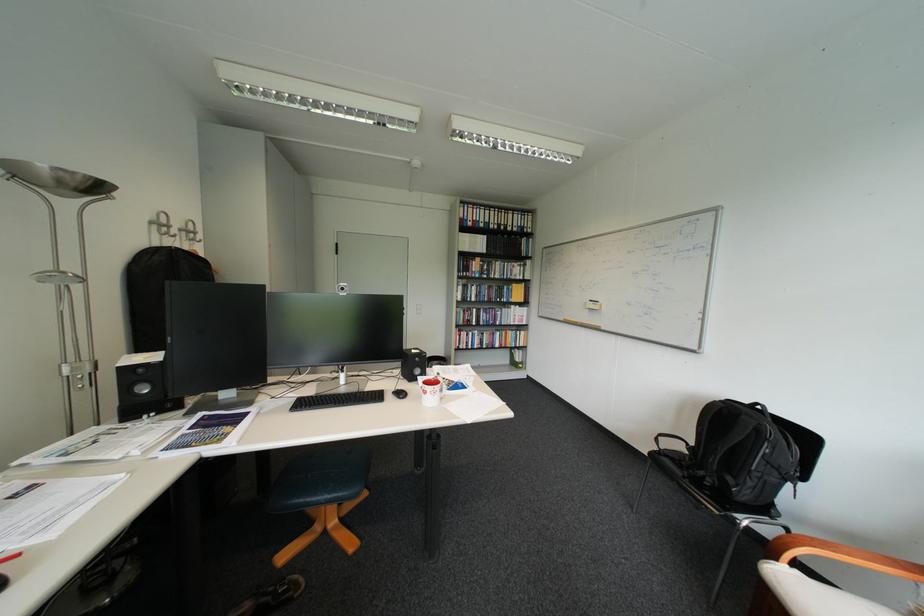
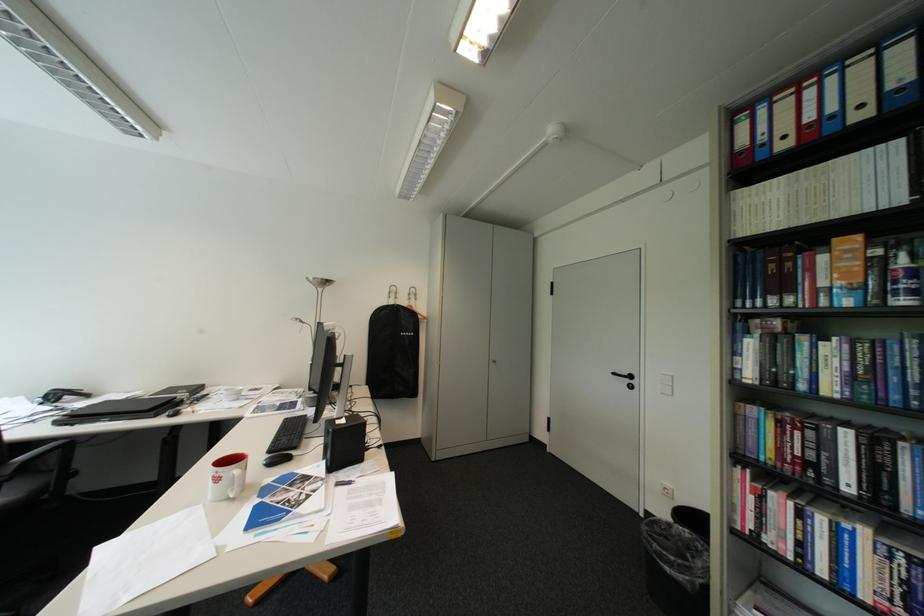
Locate, in the second image, the point that corresponds to (x=487, y=219) in the first image.

(821, 119)